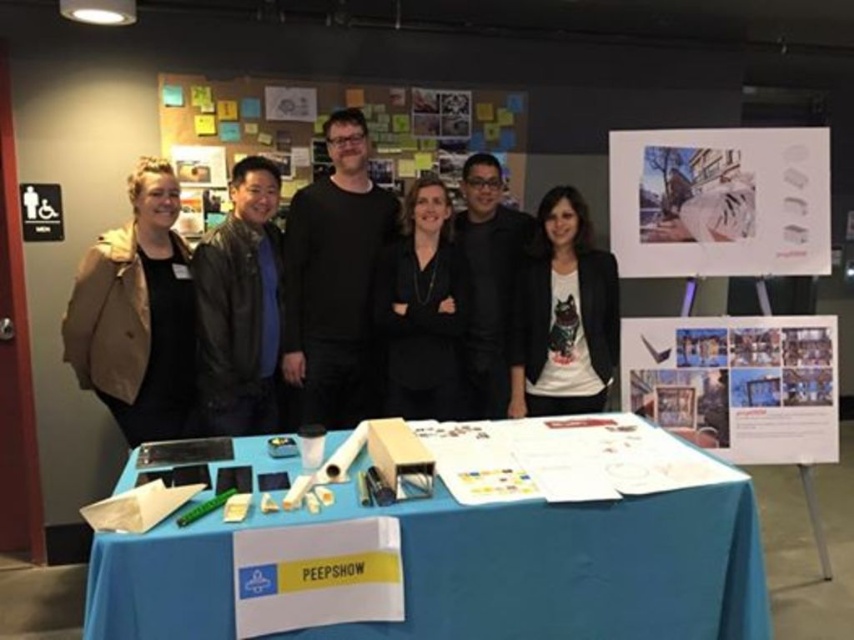
You are organizing a presentation and need to place both the white paper at upper right and the multicolored paper notes at center on a narrow shelf. Which item should you place first to ensure both fit side by side?

You should place the white paper at upper right first because it has a lesser width compared to the multicolored paper notes at center, allowing both to fit side by side on the narrow shelf.

You are a photographer at the event and want to capture a closeup of the white paper at upper right without the multicolored paper notes at center overlapping it. Based on their positions, can you achieve this?

Yes, because the white paper at upper right is closer to the viewer than the multicolored paper notes at center, so adjusting the camera angle to focus on the white paper at upper right while angling away from the multicolored paper notes at center can prevent overlap.